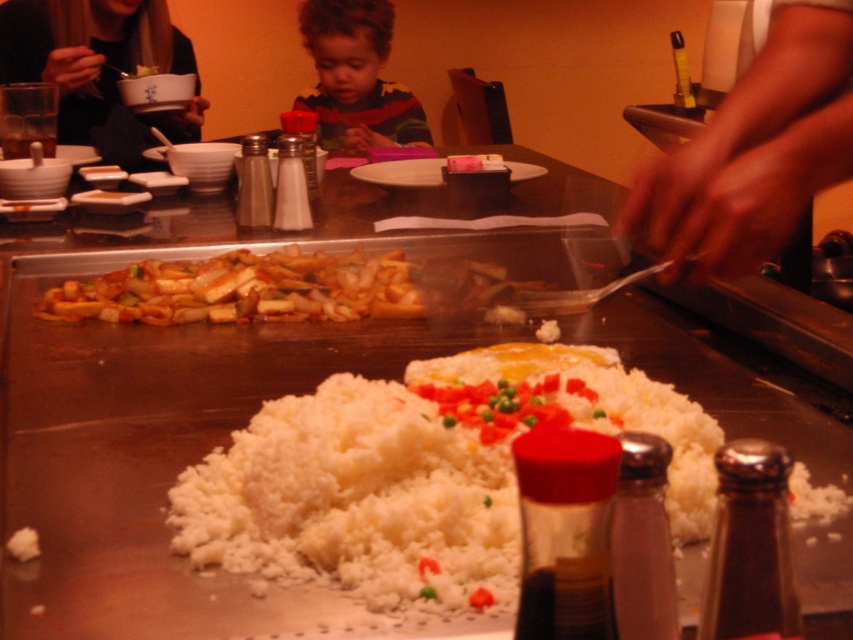
Question: Is smooth skin hands at center right closer to the viewer compared to curly-haired toddler at center?

Choices:
 (A) no
 (B) yes

Answer: (B)

Question: Which object is the farthest from the curly-haired toddler at center?

Choices:
 (A) white glossy plate at center
 (B) blonde hair at upper left
 (C) brown glossy stir-fry at center
 (D) smooth skin hands at center right

Answer: (D)

Question: Does brown glossy stir-fry at center come in front of blonde hair at upper left?

Choices:
 (A) yes
 (B) no

Answer: (A)

Question: Can you confirm if curly-haired toddler at center is bigger than white glossy plate at center?

Choices:
 (A) no
 (B) yes

Answer: (B)

Question: Which point appears farthest from the camera in this image?

Choices:
 (A) (764, 141)
 (B) (381, 294)
 (C) (96, 33)
 (D) (403, 173)

Answer: (C)

Question: Which point appears closest to the camera in this image?

Choices:
 (A) (77, 285)
 (B) (440, 179)

Answer: (A)